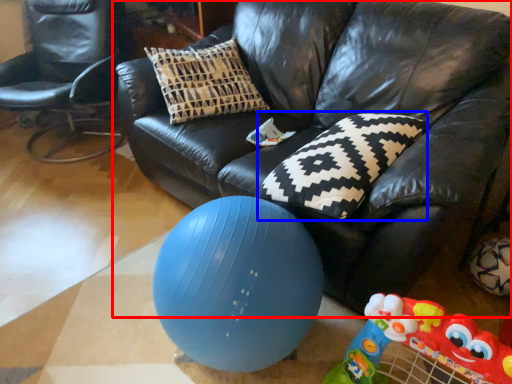
Question: Which object is further to the camera taking this photo, studio couch (highlighted by a red box) or pillow (highlighted by a blue box)?

Choices:
 (A) studio couch
 (B) pillow

Answer: (B)